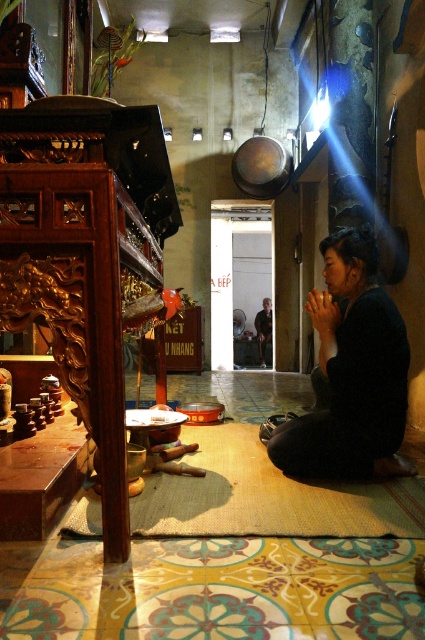
Is black matte dress at lower right taller than dark brown leather jacket at center?

Incorrect, black matte dress at lower right's height is not larger of dark brown leather jacket at center's.

Between black matte dress at lower right and dark brown leather jacket at center, which one has less height?

Standing shorter between the two is black matte dress at lower right.

Locate an element on the screen. The height and width of the screenshot is (640, 425). black matte dress at lower right is located at coordinates (351, 372).